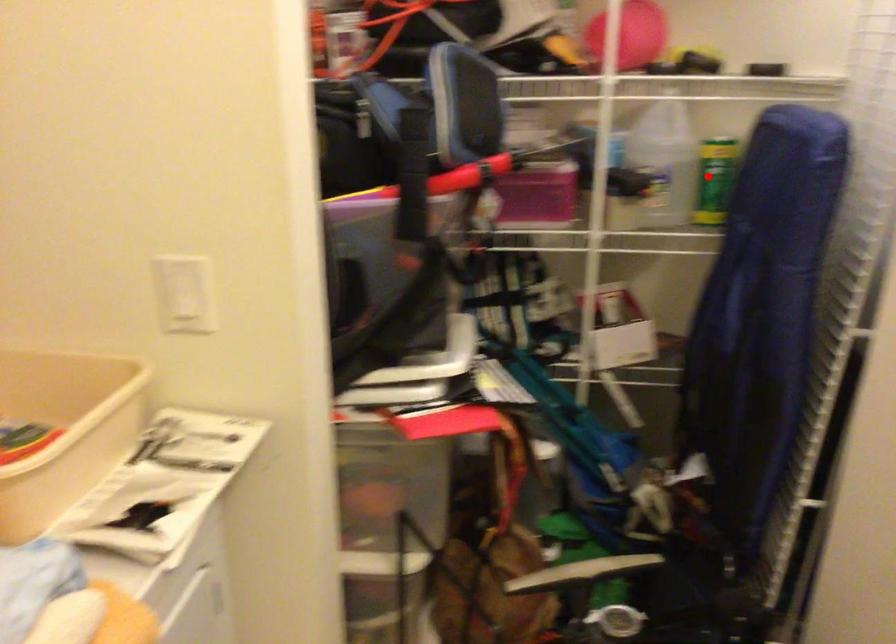
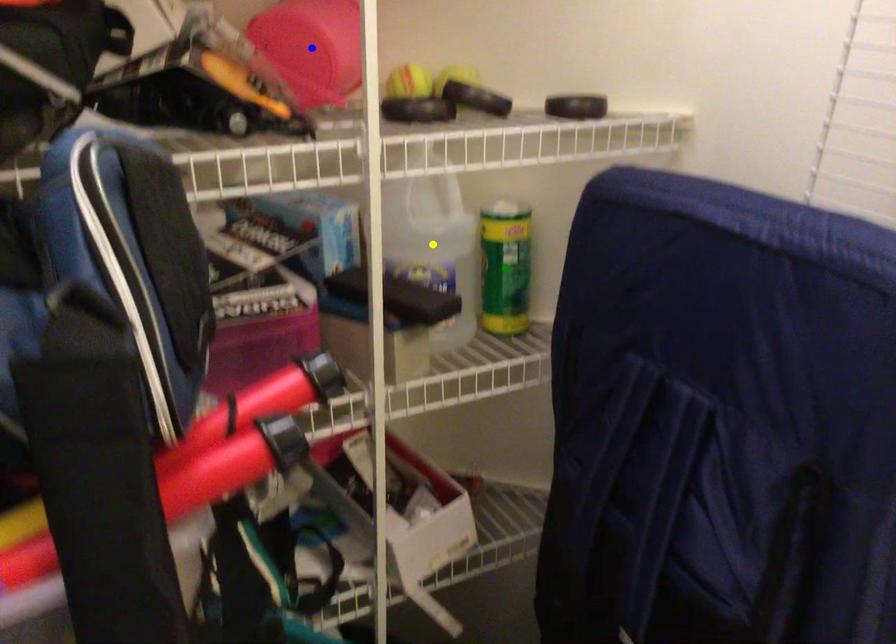
Question: I am providing you with two images of the same scene from different viewpoints. A red point is marked on the first image. You are given multiple points on the second image. Which point in image 2 represents the same 3d spot as the red point in image 1?

Choices:
 (A) yellow point
 (B) blue point
 (C) green point

Answer: (C)